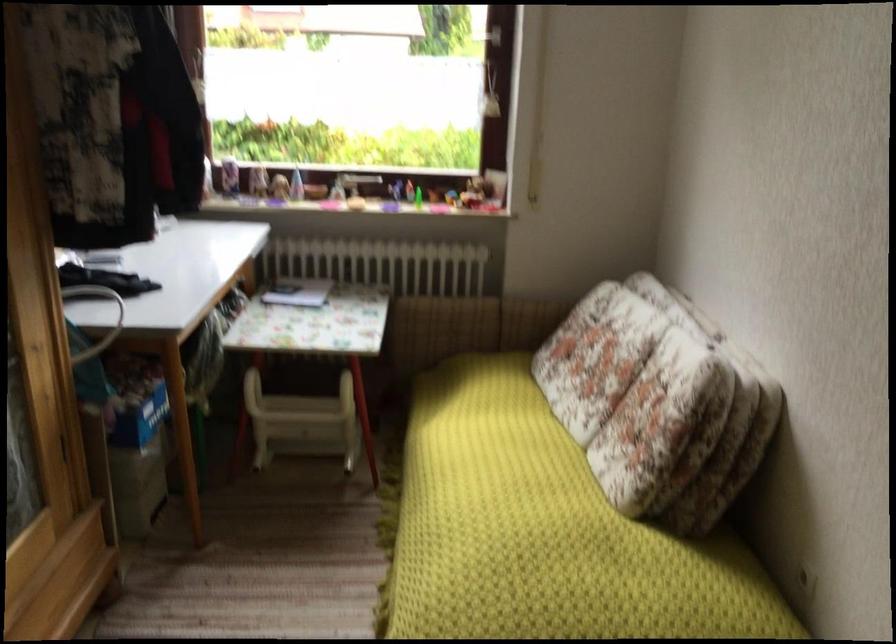
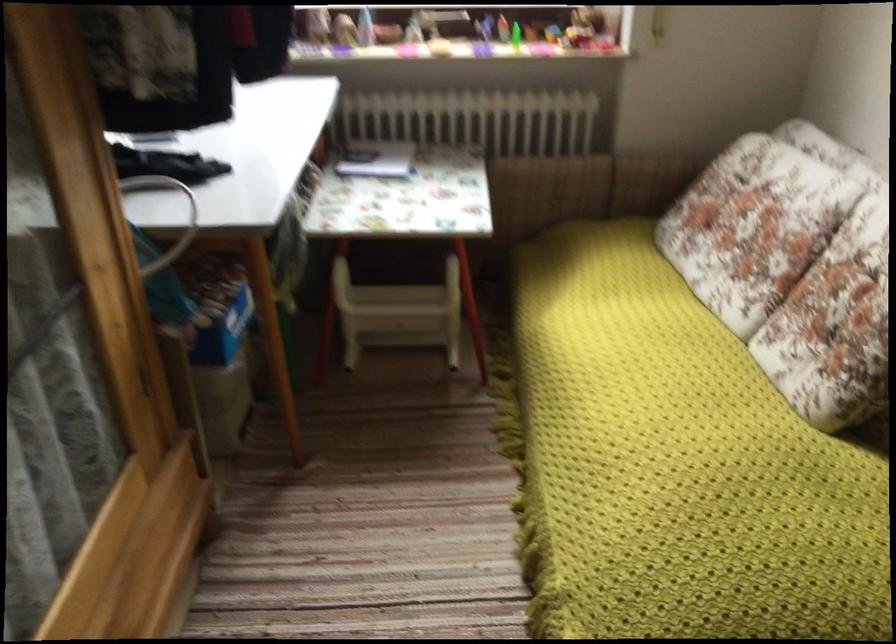
The images are taken continuously from a first-person perspective. In which direction are you moving?

The cameraman walked toward left, forward.